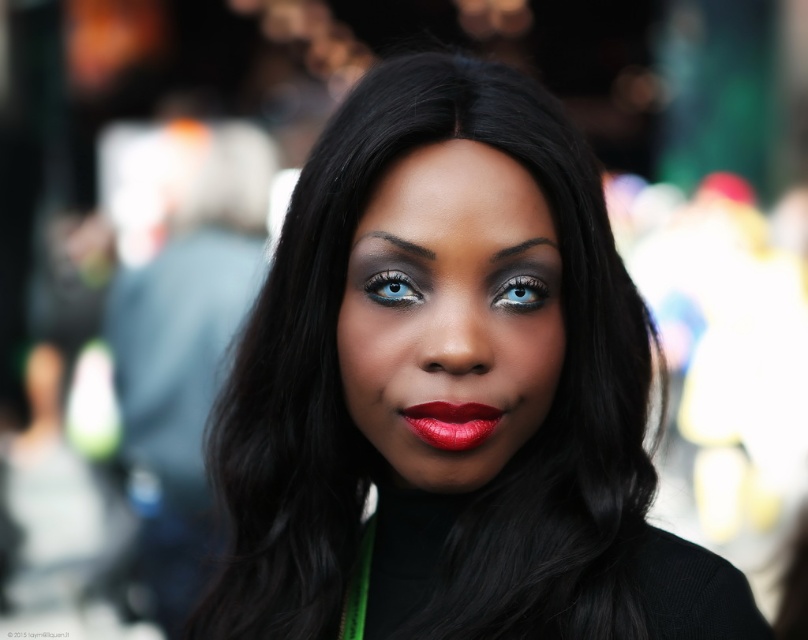
In the scene shown: Between blue matte eye at upper center and blue glossy eye at upper center, which one is positioned lower?

blue matte eye at upper center is below.

In the scene shown: Does blue matte eye at upper center have a greater width compared to blue glossy eye at upper center?

Indeed, blue matte eye at upper center has a greater width compared to blue glossy eye at upper center.

I want to click on blue matte eye at upper center, so click(x=520, y=292).

Is point (478, 403) behind point (390, 300)?

No, (478, 403) is closer to viewer.

Where is `shiny matte lipstick at center`? shiny matte lipstick at center is located at coordinates (451, 422).

Does matte black hair at center appear on the right side of matte black face at center?

Correct, you'll find matte black hair at center to the right of matte black face at center.

Does point (360, 150) lie behind point (554, 285)?

That is False.

Which is in front, point (327, 419) or point (520, 218)?

Point (520, 218) is more forward.

At what (x,y) coordinates should I click in order to perform the action: click on matte black hair at center. Please return your answer as a coordinate pair (x, y). The height and width of the screenshot is (640, 808). Looking at the image, I should click on pos(449,392).